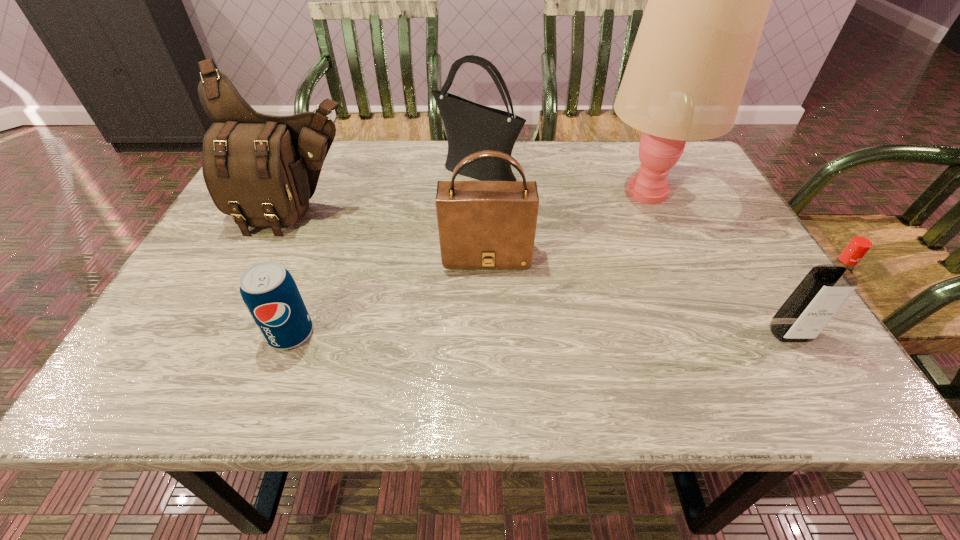
Locate an element on the screen. This screenshot has width=960, height=540. lampshade is located at coordinates (708, 0).

Find the location of `the second nearest shoulder bag`. the second nearest shoulder bag is located at coordinates (260, 169).

Where is `the farthest shoulder bag`? Image resolution: width=960 pixels, height=540 pixels. the farthest shoulder bag is located at coordinates (470, 127).

The height and width of the screenshot is (540, 960). What are the coordinates of `the fourth farthest object` in the screenshot? It's located at (482, 224).

Locate an element on the screen. This screenshot has height=540, width=960. the shortest shoulder bag is located at coordinates (482, 224).

The height and width of the screenshot is (540, 960). Identify the location of vodka. (823, 291).

This screenshot has width=960, height=540. In order to click on pop in this screenshot , I will do `click(268, 290)`.

Identify the location of free location located on the front of the lampshade. (723, 357).

The image size is (960, 540). Identify the location of vacant region located on the front-facing side of the leftmost shoulder bag. (231, 355).

Identify the location of vacant space located on the right of the farthest shoulder bag. (626, 171).